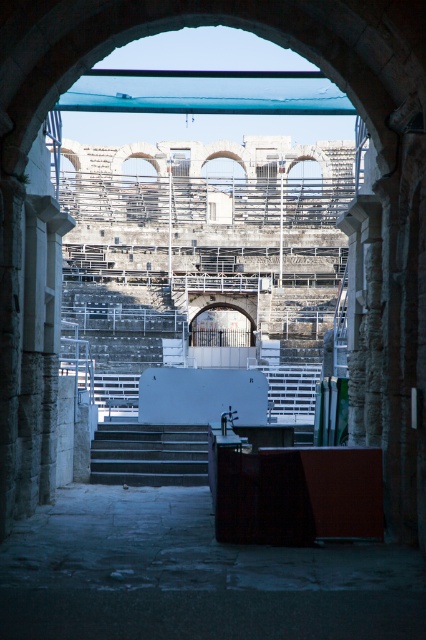
Question: Among these points, which one is farthest from the camera?

Choices:
 (A) (120, 433)
 (B) (271, 420)

Answer: (B)

Question: Among these points, which one is nearest to the camera?

Choices:
 (A) (132, 424)
 (B) (299, 396)

Answer: (A)

Question: Is dark gray concrete stairs at center positioned in front of white plastic stairs at center?

Choices:
 (A) yes
 (B) no

Answer: (A)

Question: Does dark gray concrete stairs at center appear under white plastic stairs at center?

Choices:
 (A) yes
 (B) no

Answer: (A)

Question: Which point is closer to the camera?

Choices:
 (A) dark gray concrete stairs at center
 (B) white plastic stairs at center

Answer: (A)

Question: Is dark gray concrete stairs at center to the right of white plastic stairs at center from the viewer's perspective?

Choices:
 (A) yes
 (B) no

Answer: (B)